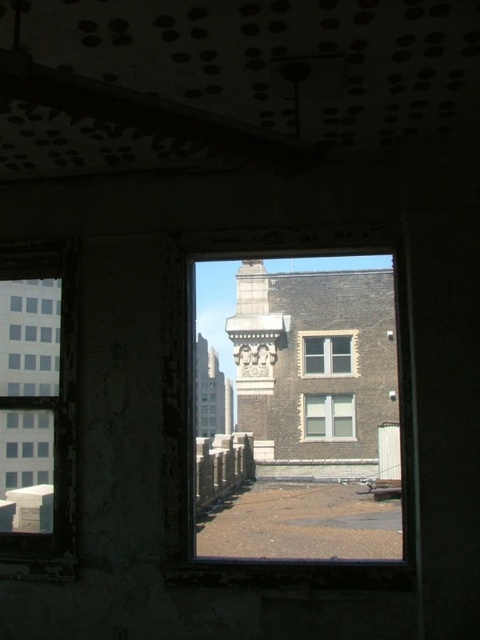
Question: Estimate the real-world distances between objects in this image. Which object is closer to the clear glass window at left?

Choices:
 (A) clear glass window at center
 (B) brown stone building at center
 (C) white glass window at center

Answer: (A)

Question: Which point is closer to the camera?

Choices:
 (A) clear glass window at center
 (B) white glass window at center

Answer: (A)

Question: Is clear glass window at left behind white glass window at center?

Choices:
 (A) yes
 (B) no

Answer: (B)

Question: Which point is closer to the camera?

Choices:
 (A) (45, 337)
 (B) (331, 374)
 (C) (311, 419)
 (D) (325, 545)

Answer: (D)

Question: Does brown stone building at center appear on the left side of white glass window at center?

Choices:
 (A) yes
 (B) no

Answer: (A)

Question: Does brown stone building at center have a lesser width compared to white glass window at center?

Choices:
 (A) yes
 (B) no

Answer: (B)